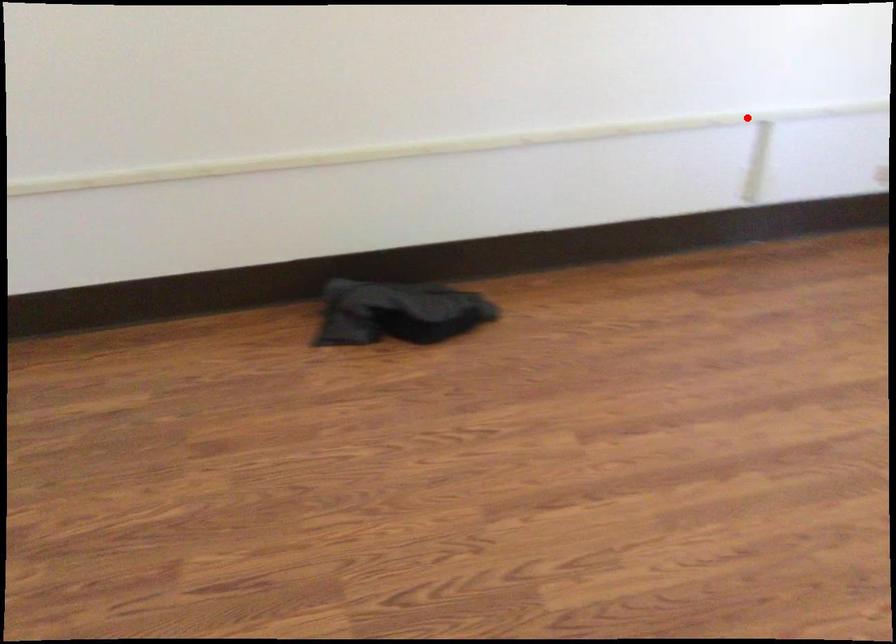
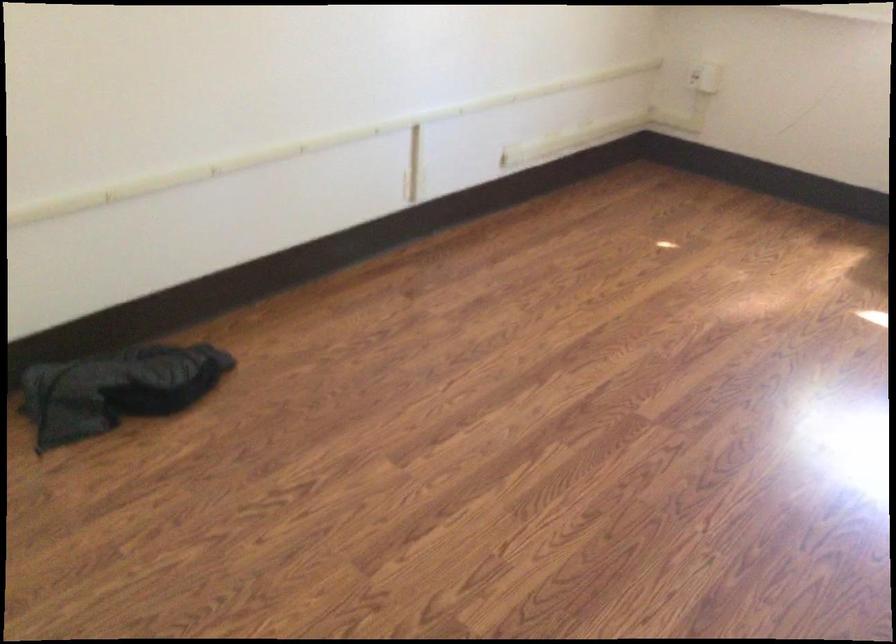
Where in the second image is the point corresponding to the highlighted location from the first image?

(407, 122)